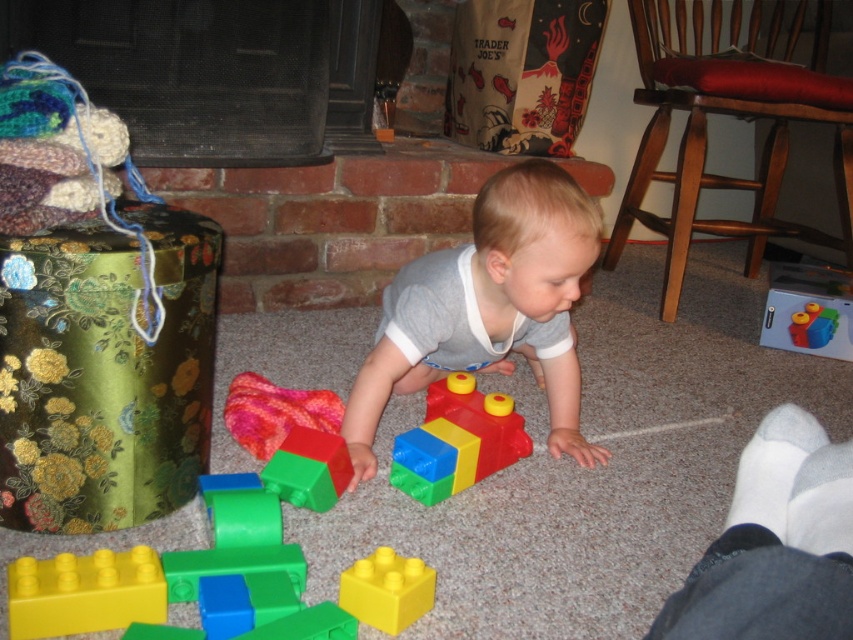
What do you see at coordinates (308, 468) in the screenshot?
I see `rubberized plastic blocks at center` at bounding box center [308, 468].

Does rubberized plastic blocks at center have a larger size compared to bright blue plastic blocks at center?

Correct, rubberized plastic blocks at center is larger in size than bright blue plastic blocks at center.

Who is more forward, (312,484) or (822,339)?

Point (312,484)

Find the location of a particular element. This screenshot has width=853, height=640. rubberized plastic blocks at center is located at coordinates (308, 468).

Can you confirm if yellow matte plastic block at center is positioned to the left of rubberized plastic blocks at center?

No, yellow matte plastic block at center is not to the left of rubberized plastic blocks at center.

Who is more distant from viewer, (387, 627) or (279, 493)?

The point (279, 493) is more distant.

Locate an element on the screen. The width and height of the screenshot is (853, 640). yellow matte plastic block at center is located at coordinates (386, 589).

Does point (370, 360) come closer to viewer compared to point (831, 337)?

Yes, point (370, 360) is in front of point (831, 337).

Which is in front, point (357, 445) or point (837, 316)?

Point (357, 445)

At what (x,y) coordinates should I click in order to perform the action: click on smooth plastic blocks at center. Please return your answer as a coordinate pair (x, y). Looking at the image, I should click on (489, 307).